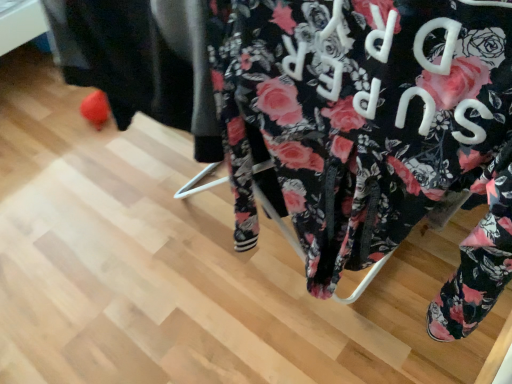
This screenshot has height=384, width=512. I want to click on floral fabric dress at upper center, so click(373, 130).

Describe the element at coordinates (373, 130) in the screenshot. I see `floral fabric dress at upper center` at that location.

Image resolution: width=512 pixels, height=384 pixels. Identify the location of floral fabric dress at upper center. pos(373,130).